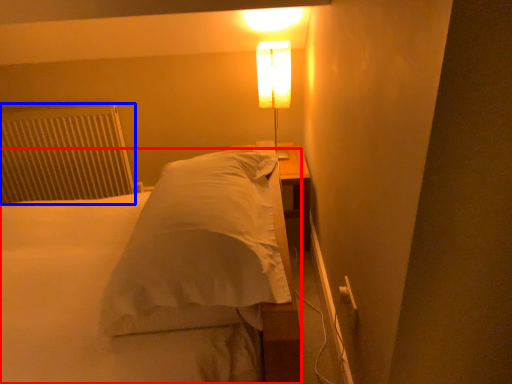
Question: Which point is further to the camera, bed (highlighted by a red box) or radiator (highlighted by a blue box)?

Choices:
 (A) bed
 (B) radiator

Answer: (B)